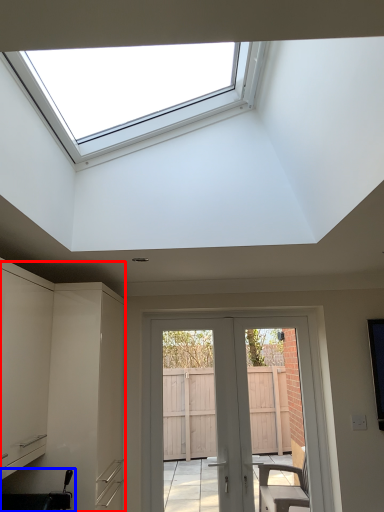
Question: Which object appears closest to the camera in this image, cabinetry (highlighted by a red box) or sink (highlighted by a blue box)?

Choices:
 (A) cabinetry
 (B) sink

Answer: (B)